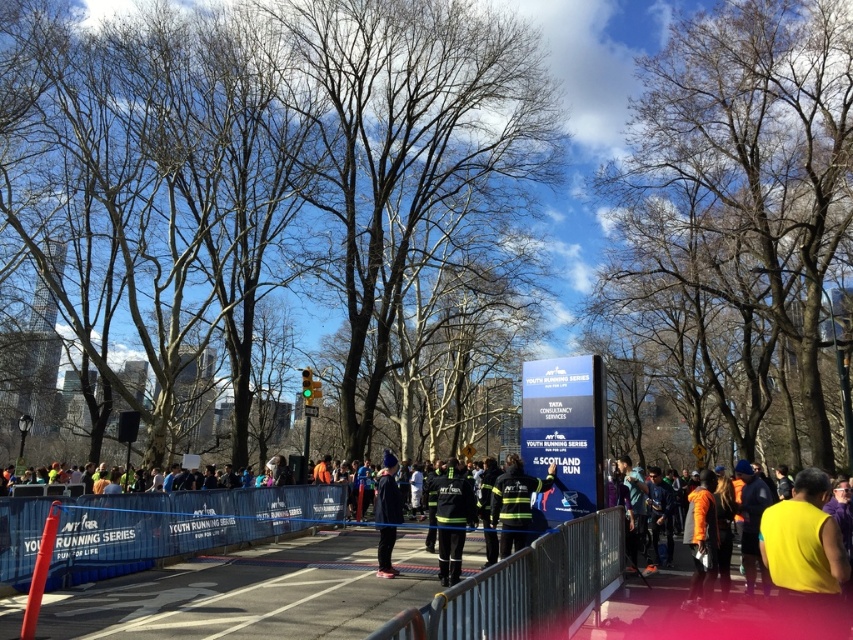
You are a photographer positioned at the edge of the crowd. You want to take a photo of the matte black uniform at center without the bare branches at center blocking the view. Is this possible given their positions?

The bare branches at center is further to the viewer than matte black uniform at center, so the branches are closer to you. To avoid blocking, you need to move your position so that the branches are not in front of the uniform.

You are a photographer standing in the crowd at the running event. You want to take a photo that includes both the bare branches at center and the yellow fabric at center. Which object should you position closer to the front of your photo to ensure both are visible?

To ensure both the bare branches at center and the yellow fabric at center are visible, position the bare branches at center closer to the front of your photo since it is closer to you than the yellow fabric at center.